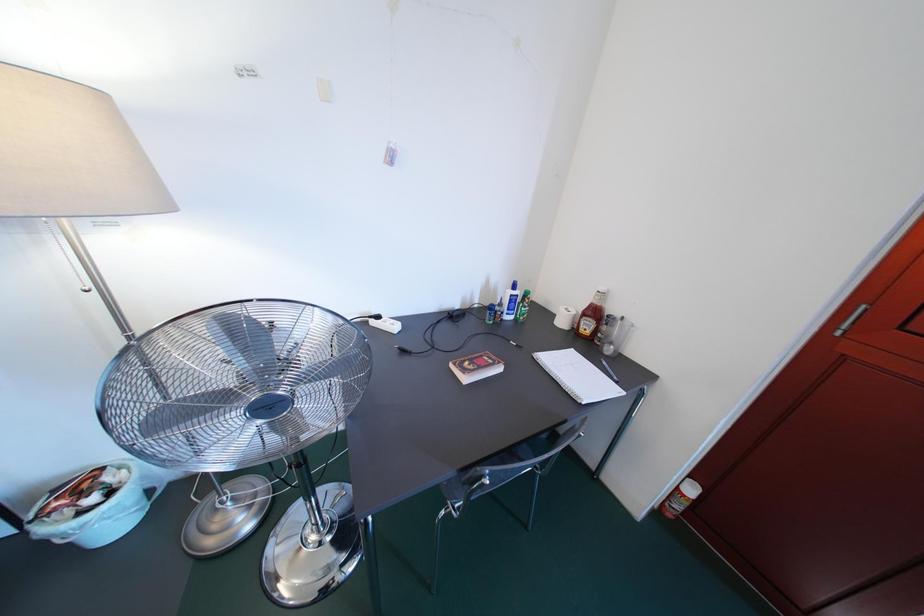
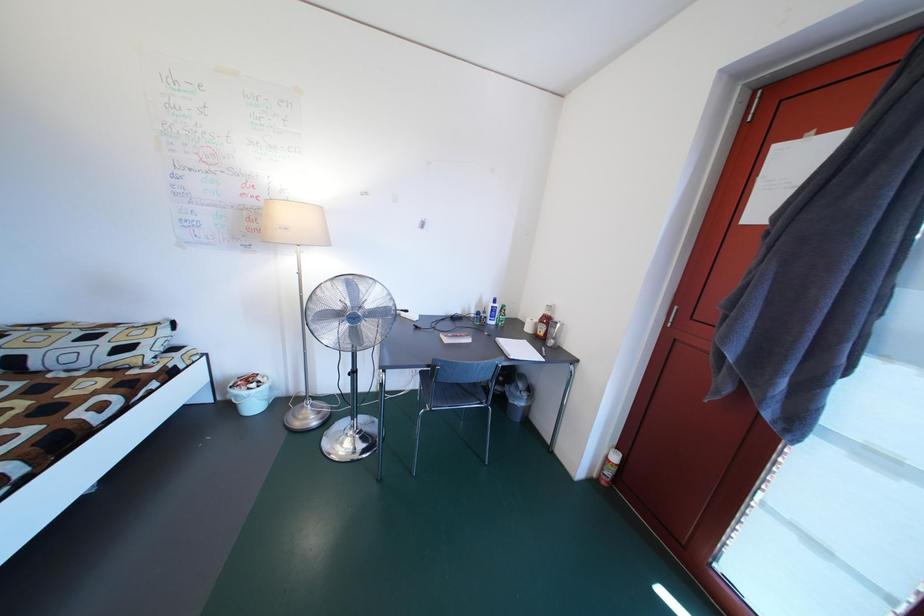
Which direction would the cameraman need to move to produce the second image?

The cameraman walked toward right, backward.